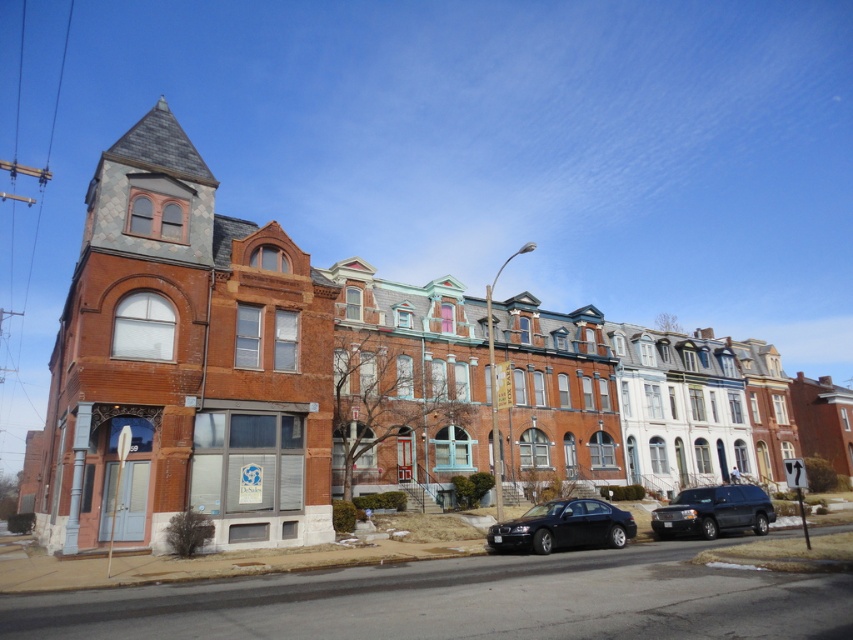
Between shiny black sedan at center and shiny black suv at lower right, which one is positioned lower?

shiny black suv at lower right is lower down.

Is point (613, 534) closer to viewer compared to point (740, 502)?

Yes, it is.

This screenshot has width=853, height=640. What do you see at coordinates (563, 525) in the screenshot?
I see `shiny black sedan at center` at bounding box center [563, 525].

Locate an element on the screen. This screenshot has height=640, width=853. shiny black sedan at center is located at coordinates (563, 525).